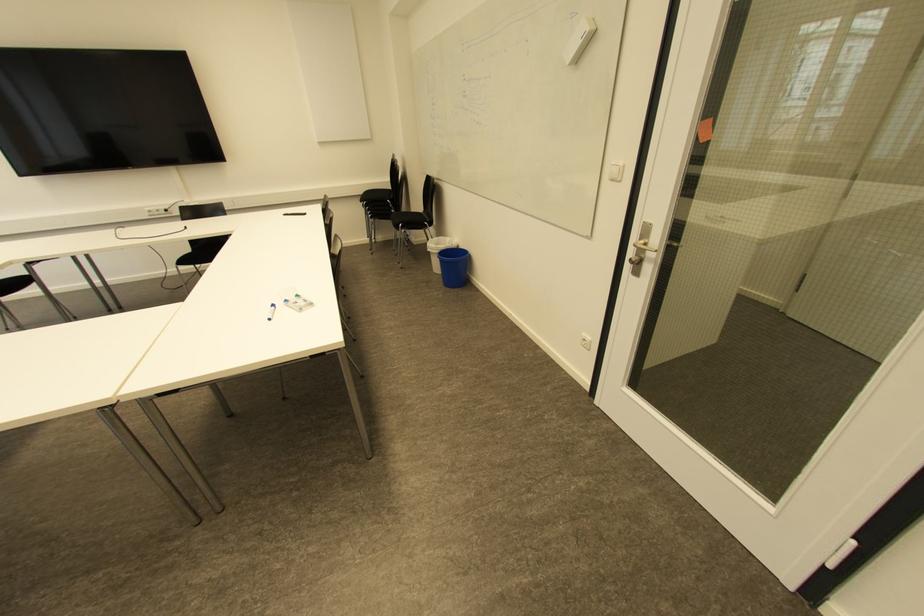
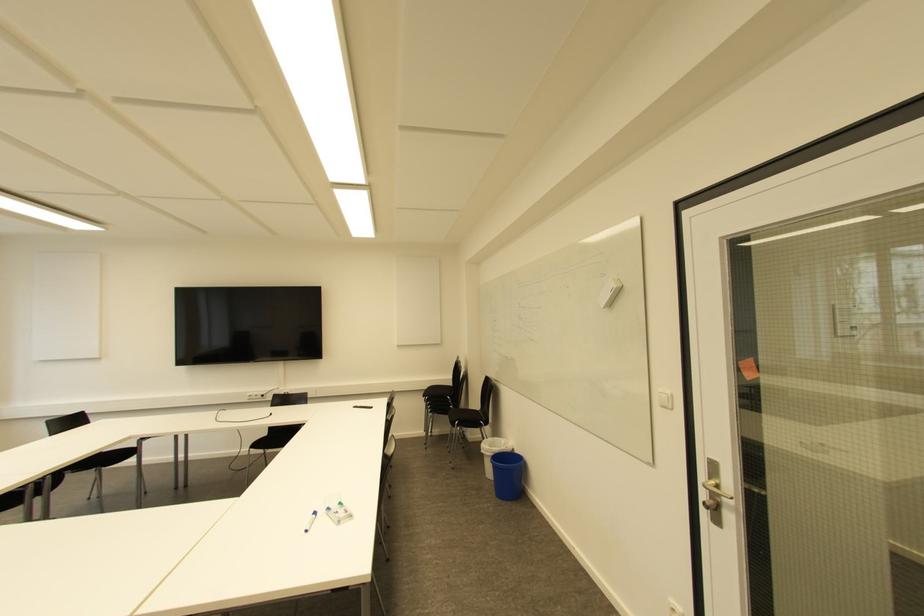
Question: How did the camera likely rotate?

Choices:
 (A) Left
 (B) Right
 (C) Up
 (D) Down

Answer: (C)